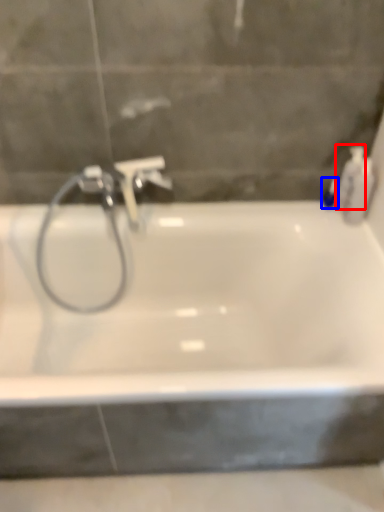
Question: Which object appears closest to the camera in this image, toiletry (highlighted by a red box) or toiletry (highlighted by a blue box)?

Choices:
 (A) toiletry
 (B) toiletry

Answer: (A)